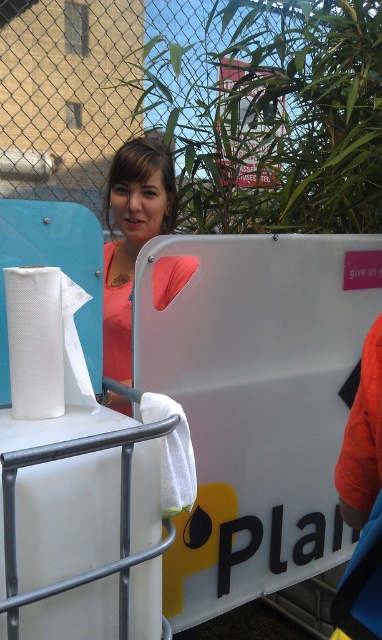
Question: Observing the image, what is the correct spatial positioning of pink matte shirt at center in reference to white paper towel at left?

Choices:
 (A) right
 (B) left

Answer: (A)

Question: Is pink matte shirt at center below white paper towel at left?

Choices:
 (A) yes
 (B) no

Answer: (B)

Question: Among these objects, which one is farthest from the camera?

Choices:
 (A) white paper towel at left
 (B) pink matte shirt at center

Answer: (B)

Question: Is pink matte shirt at center positioned in front of white paper towel at left?

Choices:
 (A) yes
 (B) no

Answer: (B)

Question: Which point is closer to the camera taking this photo?

Choices:
 (A) (137, 225)
 (B) (63, 273)

Answer: (B)